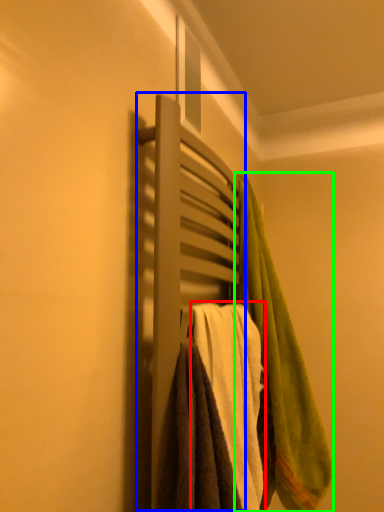
Question: Estimate the real-world distances between objects in this image. Which object is closer to towel (highlighted by a red box), closet (highlighted by a blue box) or towel (highlighted by a green box)?

Choices:
 (A) closet
 (B) towel

Answer: (B)